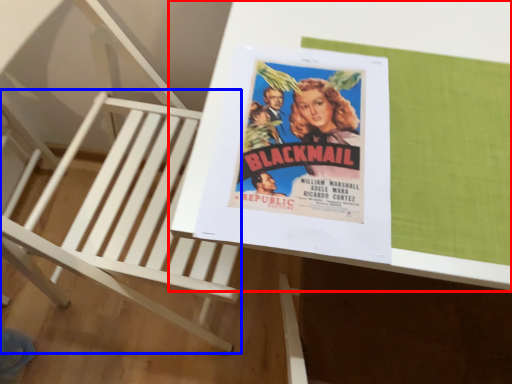
Question: Which of the following is the farthest to the observer, table (highlighted by a red box) or furniture (highlighted by a blue box)?

Choices:
 (A) table
 (B) furniture

Answer: (A)